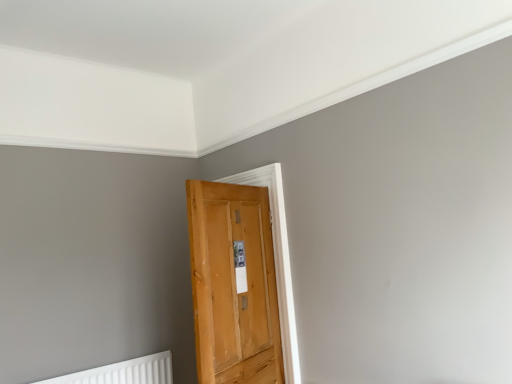
Question: In terms of size, does wooden door at center appear bigger or smaller than white plastic radiator at lower left?

Choices:
 (A) big
 (B) small

Answer: (A)

Question: From a real-world perspective, is wooden door at center physically located above or below white plastic radiator at lower left?

Choices:
 (A) below
 (B) above

Answer: (B)

Question: Considering their positions, is wooden door at center located in front of or behind white plastic radiator at lower left?

Choices:
 (A) front
 (B) behind

Answer: (A)

Question: Is white plastic radiator at lower left spatially inside wooden door at center, or outside of it?

Choices:
 (A) inside
 (B) outside

Answer: (B)

Question: Considering the positions of white plastic radiator at lower left and wooden door at center in the image, is white plastic radiator at lower left bigger or smaller than wooden door at center?

Choices:
 (A) big
 (B) small

Answer: (B)

Question: In the image, is white plastic radiator at lower left positioned in front of or behind wooden door at center?

Choices:
 (A) behind
 (B) front

Answer: (A)

Question: Considering the relative positions of white plastic radiator at lower left and wooden door at center in the image provided, is white plastic radiator at lower left to the left or to the right of wooden door at center?

Choices:
 (A) right
 (B) left

Answer: (B)